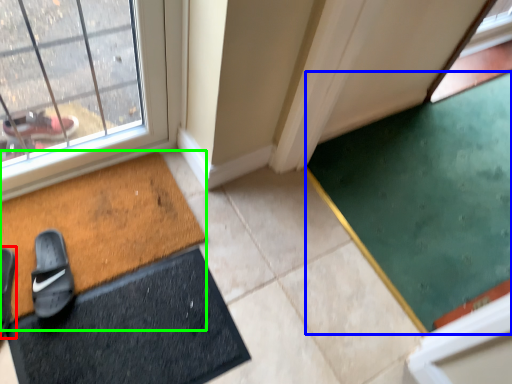
Question: Estimate the real-world distances between objects in this image. Which object is farther from footwear (highlighted by a red box), doormat (highlighted by a blue box) or bath mat (highlighted by a green box)?

Choices:
 (A) doormat
 (B) bath mat

Answer: (A)